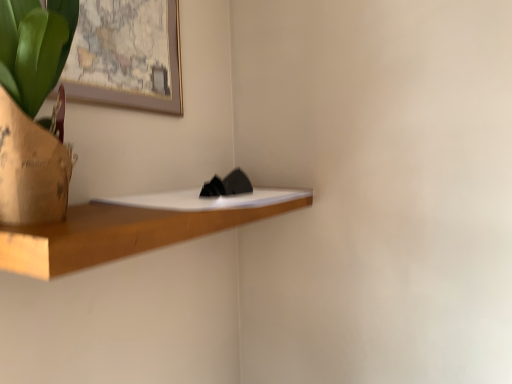
Question: From a real-world perspective, relative to wooden shelf at center, is wooden framed map at upper left vertically above or below?

Choices:
 (A) below
 (B) above

Answer: (B)

Question: Is wooden framed map at upper left wider or thinner than wooden shelf at center?

Choices:
 (A) wide
 (B) thin

Answer: (B)

Question: In the image, is wooden framed map at upper left positioned in front of or behind wooden shelf at center?

Choices:
 (A) front
 (B) behind

Answer: (B)

Question: In terms of width, does wooden shelf at center look wider or thinner when compared to wooden framed map at upper left?

Choices:
 (A) wide
 (B) thin

Answer: (A)

Question: Is wooden shelf at center in front of or behind wooden framed map at upper left in the image?

Choices:
 (A) behind
 (B) front

Answer: (B)

Question: Does point (234, 208) appear closer or farther from the camera than point (130, 49)?

Choices:
 (A) closer
 (B) farther

Answer: (A)

Question: Considering the relative positions of wooden shelf at center and wooden framed map at upper left in the image provided, is wooden shelf at center to the left or to the right of wooden framed map at upper left?

Choices:
 (A) right
 (B) left

Answer: (A)